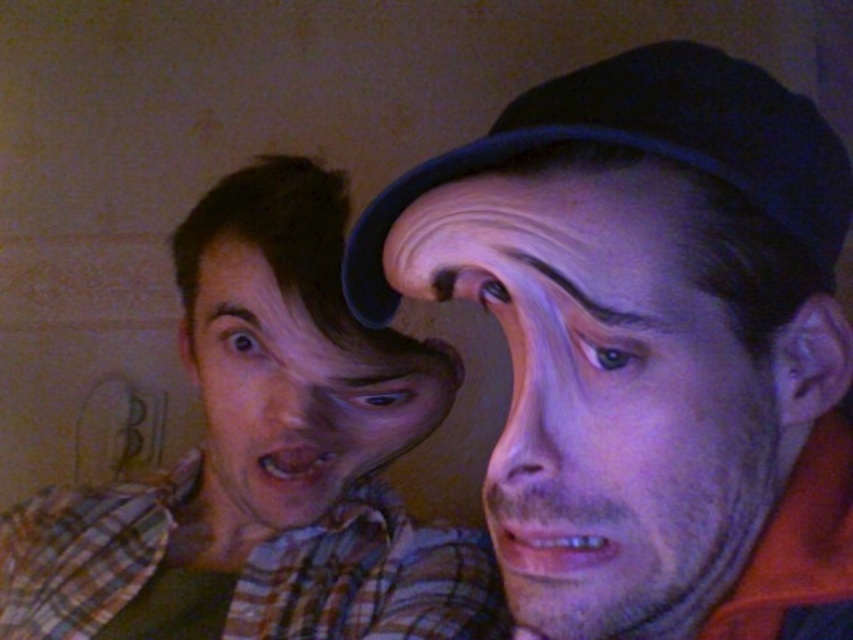
Question: Observing the image, what is the correct spatial positioning of purple matte face at center in reference to matte plaid shirt at left?

Choices:
 (A) above
 (B) below

Answer: (A)

Question: Is plaid shirt at left bigger than matte plaid shirt at left?

Choices:
 (A) yes
 (B) no

Answer: (A)

Question: Which of these objects is positioned closest to the purple matte face at center?

Choices:
 (A) plaid shirt at left
 (B) matte plaid shirt at left

Answer: (B)

Question: Among these objects, which one is nearest to the camera?

Choices:
 (A) purple matte face at center
 (B) matte plaid shirt at left

Answer: (A)

Question: Can you confirm if plaid shirt at left is positioned to the left of purple matte face at center?

Choices:
 (A) no
 (B) yes

Answer: (B)

Question: Which point appears closest to the camera in this image?

Choices:
 (A) (712, 428)
 (B) (282, 314)

Answer: (A)